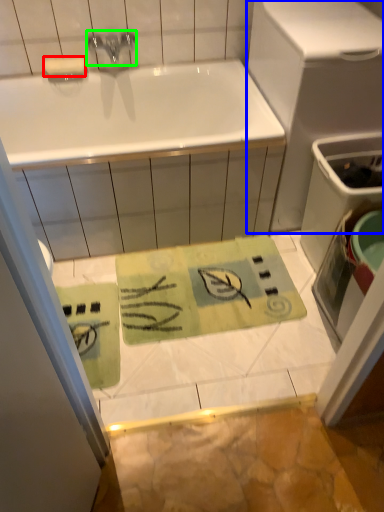
Question: Which is farther away from soap (highlighted by a red box)? appliance (highlighted by a blue box) or tap (highlighted by a green box)?

Choices:
 (A) appliance
 (B) tap

Answer: (A)